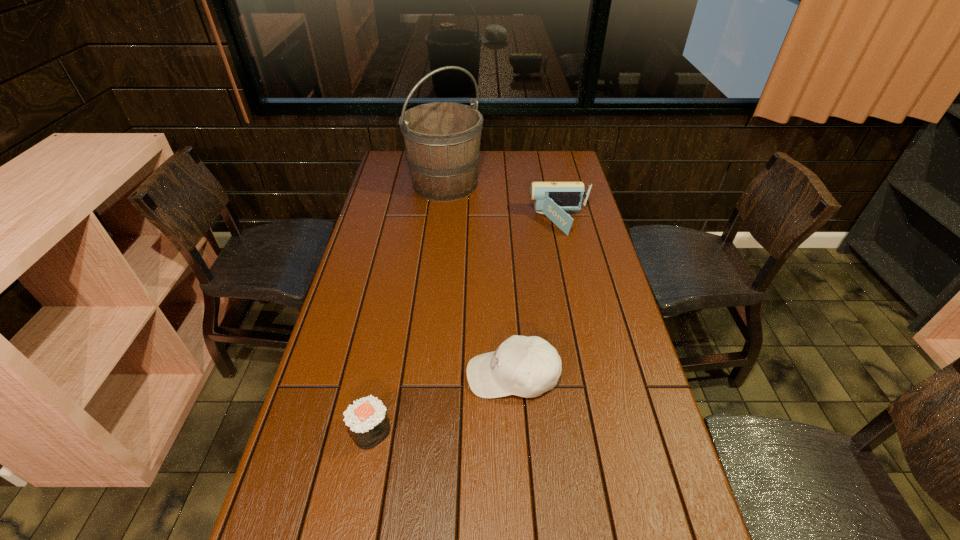
This screenshot has width=960, height=540. Find the location of `object that is the closest one to the third farthest object`. object that is the closest one to the third farthest object is located at coordinates click(366, 418).

Select which object appears as the second closest to the tallest object. Please provide its 2D coordinates. Your answer should be formatted as a tuple, i.e. [(x, y)], where the tuple contains the x and y coordinates of a point satisfying the conditions above.

[(523, 366)]